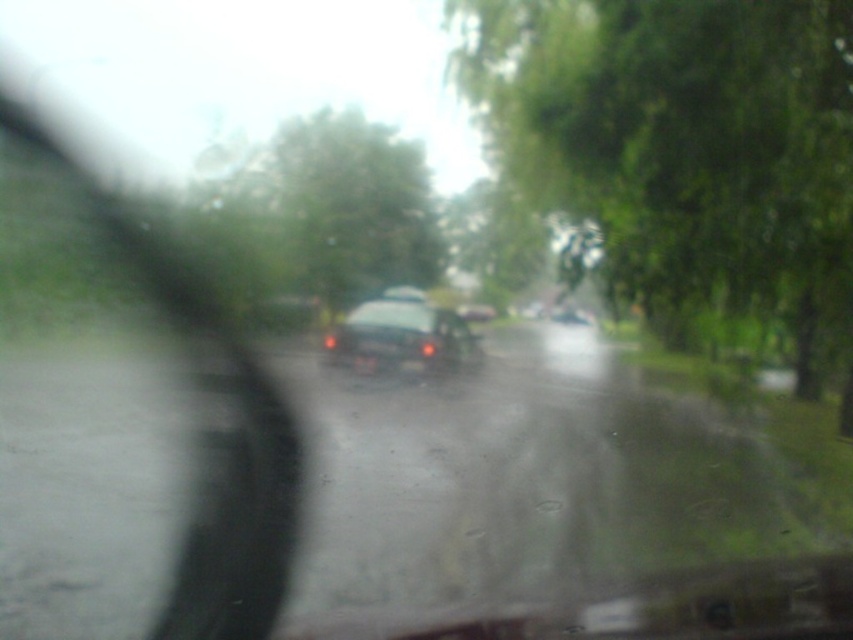
You are a passenger in the car and want to know if the point at coordinate point [268,630] is closer to you than the point at coordinate point [378,364]. Can you determine this based on the scene?

Yes, according to the scene description, point [268,630] is closer to the camera than point [378,364], so it is closer to you as a passenger in the car.

You are driving in the rain and notice a green leafy tree at upper right and a transparent plastic mirror at left in your view. Which object appears taller in your view?

The transparent plastic mirror at left appears taller than the green leafy tree at upper right because the green leafy tree at upper right is shorter than transparent plastic mirror at left.

You are driving a car and see the glossy black car at center ahead. There is a green leafy tree at upper right in your view. Which object is wider in your current view?

The green leafy tree at upper right might be wider than glossy black car at center.